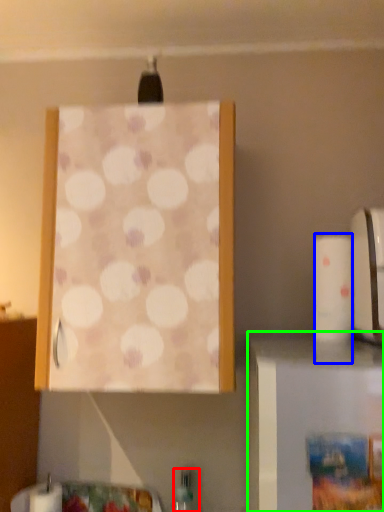
Question: Which object is the closest to the bottle (highlighted by a red box)? Choose among these: toilet paper (highlighted by a blue box) or furniture (highlighted by a green box).

Choices:
 (A) toilet paper
 (B) furniture

Answer: (A)